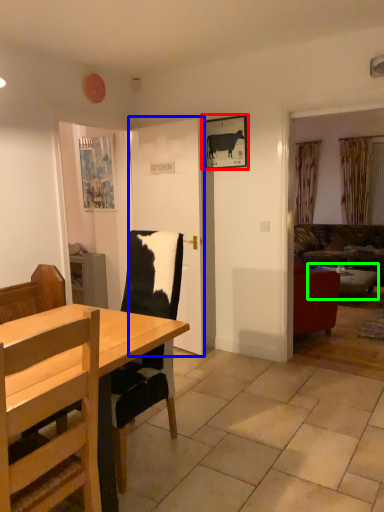
Question: Considering the real-world distances, which object is closest to picture frame (highlighted by a red box)? door (highlighted by a blue box) or table (highlighted by a green box).

Choices:
 (A) door
 (B) table

Answer: (A)